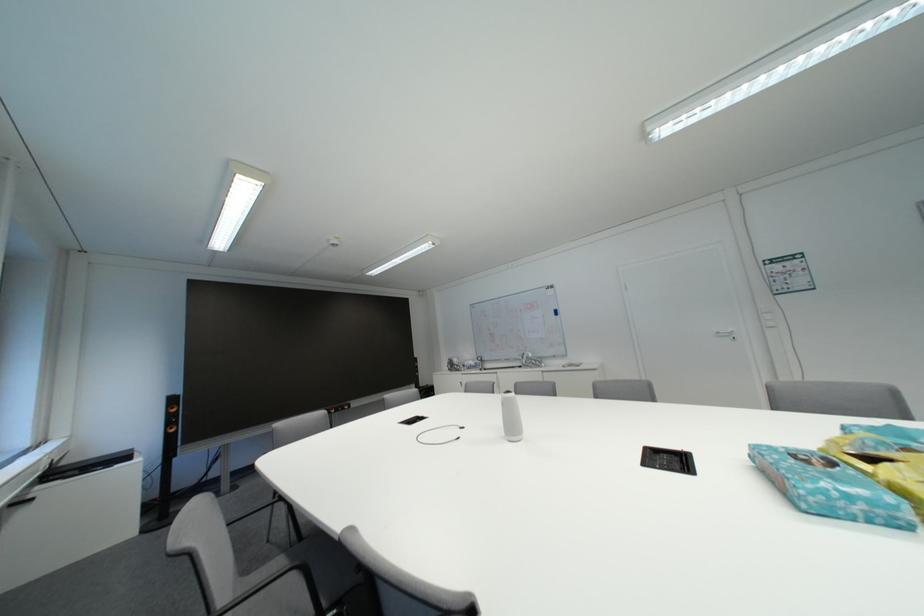
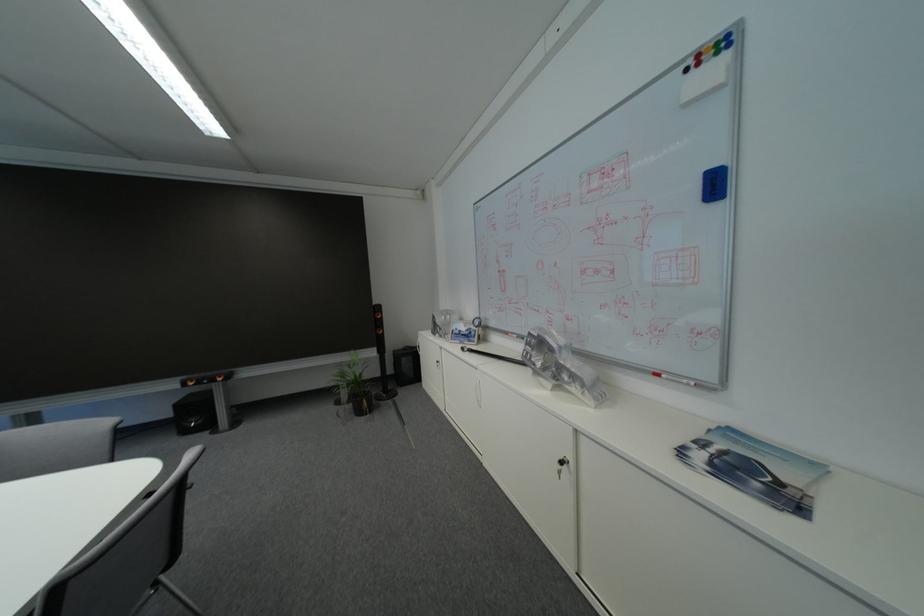
Locate, in the second image, the point that corresponds to point (560, 286) in the first image.

(723, 34)